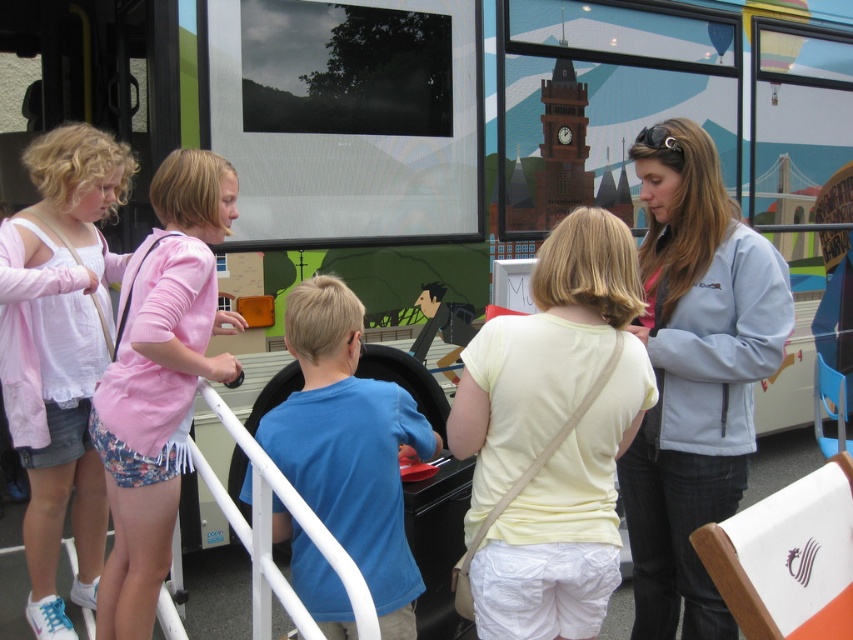
Is light blue softshell jacket at upper right in front of blue cotton shirt at center?

No, light blue softshell jacket at upper right is further to the viewer.

Who is lower down, light blue softshell jacket at upper right or blue cotton shirt at center?

Positioned lower is blue cotton shirt at center.

This screenshot has width=853, height=640. In order to click on light blue softshell jacket at upper right in this screenshot , I will do `click(694, 374)`.

Locate an element on the screen. The width and height of the screenshot is (853, 640). light blue softshell jacket at upper right is located at coordinates (694, 374).

Can you confirm if light blue softshell jacket at upper right is bigger than pink fabric shorts at left?

Actually, light blue softshell jacket at upper right might be smaller than pink fabric shorts at left.

Is light blue softshell jacket at upper right below pink fabric shorts at left?

No, light blue softshell jacket at upper right is not below pink fabric shorts at left.

This screenshot has height=640, width=853. What are the coordinates of `light blue softshell jacket at upper right` in the screenshot? It's located at (694, 374).

Can you confirm if light yellow t-shirt at center is thinner than pink fabric shorts at left?

No.

Between point (508, 566) and point (196, 291), which one is positioned behind?

The point (196, 291) is more distant.

Who is more forward, [537,326] or [142,592]?

Positioned in front is point [537,326].

Locate an element on the screen. light yellow t-shirt at center is located at coordinates (543, 353).